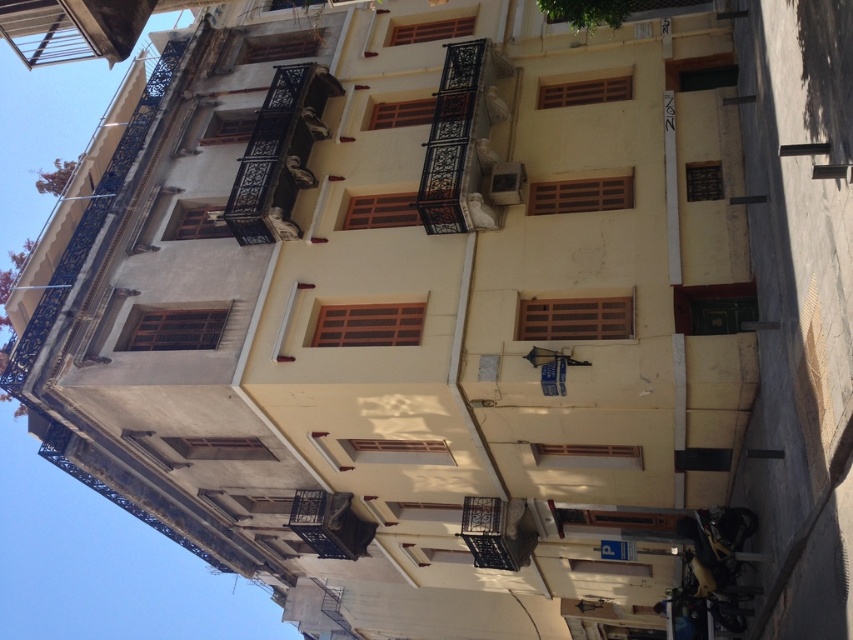
Question: Which point is closer to the camera?

Choices:
 (A) smooth concrete sidewalk at lower right
 (B) rustic wrought iron balcony at center

Answer: (A)

Question: Does smooth concrete sidewalk at lower right appear under rustic wrought iron balcony at center?

Choices:
 (A) yes
 (B) no

Answer: (B)

Question: From the image, what is the correct spatial relationship of rustic wrought iron balcony at center in relation to black wrought iron balcony at center?

Choices:
 (A) left
 (B) right

Answer: (B)

Question: Which object is closer to the camera taking this photo?

Choices:
 (A) black wrought iron balcony at center
 (B) rustic wrought iron balcony at center

Answer: (B)

Question: Which object is the farthest from the rustic wrought iron balcony at center?

Choices:
 (A) black wrought iron balcony at center
 (B) smooth concrete sidewalk at lower right

Answer: (B)

Question: Can you confirm if smooth concrete sidewalk at lower right is bigger than rustic wrought iron balcony at center?

Choices:
 (A) no
 (B) yes

Answer: (B)